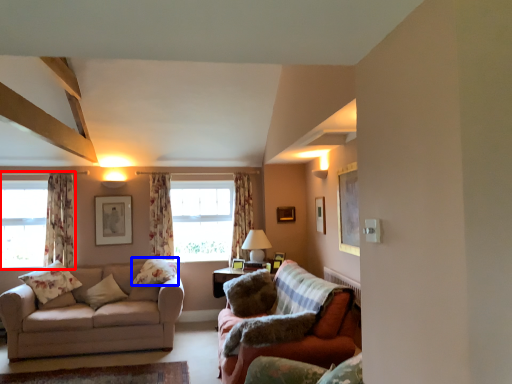
Question: Among these objects, which one is farthest to the camera, window (highlighted by a red box) or pillow (highlighted by a blue box)?

Choices:
 (A) window
 (B) pillow

Answer: (A)